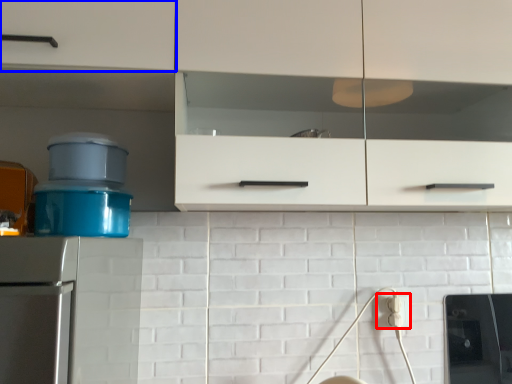
Question: Which object is closer to the camera taking this photo, electric outlet (highlighted by a red box) or cabinetry (highlighted by a blue box)?

Choices:
 (A) electric outlet
 (B) cabinetry

Answer: (B)